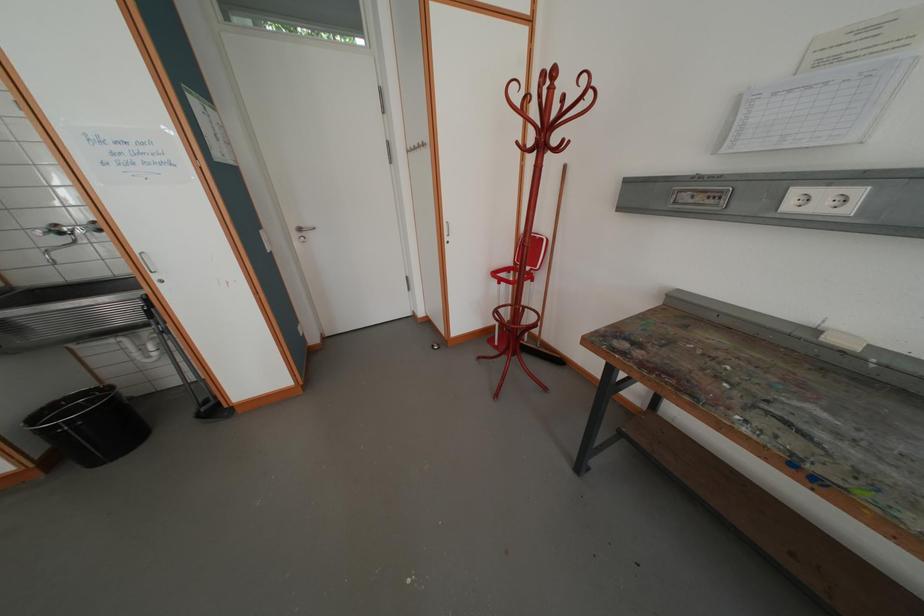
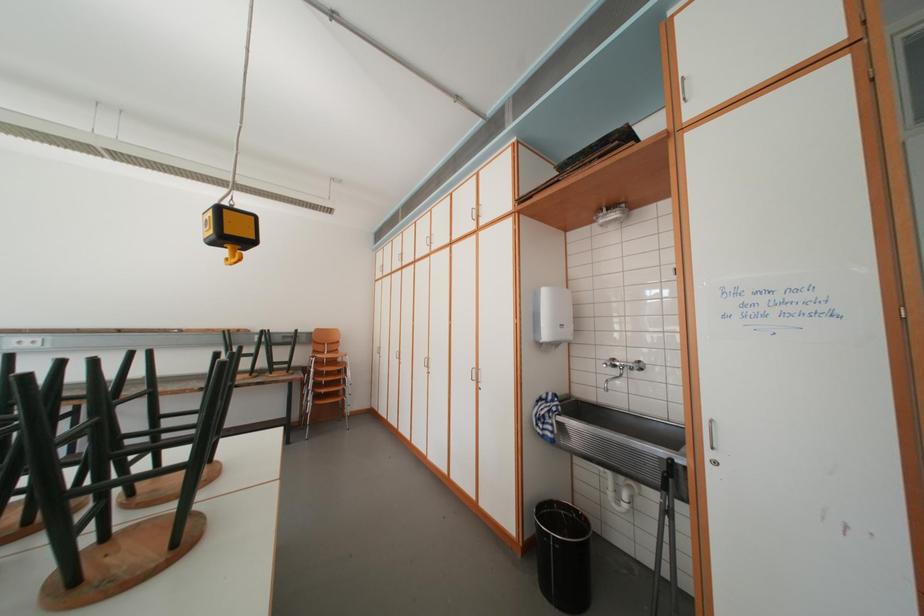
Question: The images are taken continuously from a first-person perspective. In which direction is your viewpoint rotating?

Choices:
 (A) Left
 (B) Right
 (C) Up
 (D) Down

Answer: (A)